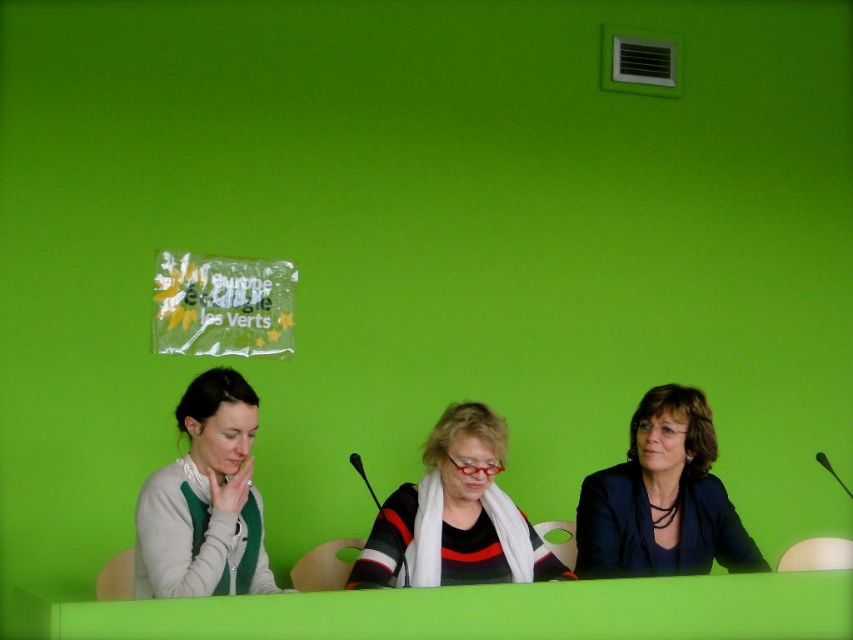
Between blue fabric jacket at center and striped sweater with scarf at center, which one has more height?

With more height is blue fabric jacket at center.

What are the coordinates of `blue fabric jacket at center` in the screenshot? It's located at (662, 499).

Identify the location of blue fabric jacket at center. The image size is (853, 640). (662, 499).

Measure the distance from white matte sweater at left to striped sweater with scarf at center.

white matte sweater at left and striped sweater with scarf at center are 19.39 inches apart from each other.

Consider the image. Who is shorter, white matte sweater at left or striped sweater with scarf at center?

striped sweater with scarf at center is shorter.

Where is `white matte sweater at left`? The width and height of the screenshot is (853, 640). white matte sweater at left is located at coordinates (204, 500).

Locate an element on the screen. This screenshot has width=853, height=640. white matte sweater at left is located at coordinates (204, 500).

How much distance is there between green matte table at center and white matte sweater at left?

green matte table at center is 16.15 inches away from white matte sweater at left.

At what (x,y) coordinates should I click in order to perform the action: click on green matte table at center. Please return your answer as a coordinate pair (x, y). Looking at the image, I should click on 473,611.

This screenshot has width=853, height=640. Identify the location of green matte table at center. (x=473, y=611).

I want to click on green matte table at center, so click(473, 611).